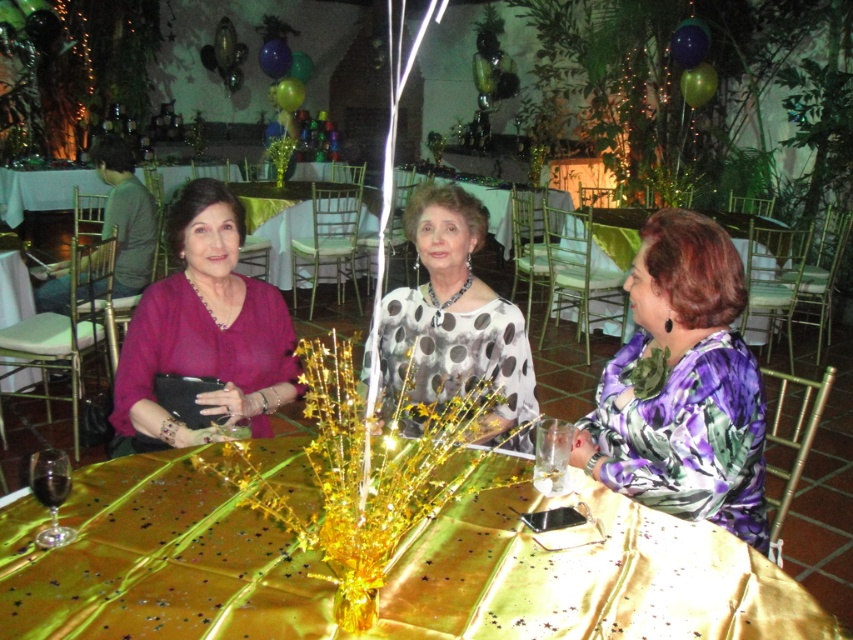
Looking at this image, is gold satin tablecloth at center below translucent glass wine glass at lower left?

Incorrect, gold satin tablecloth at center is not positioned below translucent glass wine glass at lower left.

Is gold satin tablecloth at center smaller than translucent glass wine glass at lower left?

No.

Does point (45, 209) come behind point (41, 502)?

That is True.

You are a GUI agent. You are given a task and a screenshot of the screen. Output one action in this format:
    pyautogui.click(x=<x>, y=<y>)
    Task: Click on the gold satin tablecloth at center
    This screenshot has width=853, height=640.
    Given the screenshot: What is the action you would take?
    pyautogui.click(x=44, y=189)

Does matte black table at center have a greater width compared to translucent glass wine glass at lower left?

Correct, the width of matte black table at center exceeds that of translucent glass wine glass at lower left.

Is matte black table at center further to the viewer compared to translucent glass wine glass at lower left?

Yes, matte black table at center is behind translucent glass wine glass at lower left.

Locate an element on the screen. matte black table at center is located at coordinates (485, 205).

Between point (271, 477) and point (538, 490), which one is positioned in front?

Point (538, 490) is in front.

Does metallic gold table at center have a smaller size compared to transparent glass at center?

No, metallic gold table at center is not smaller than transparent glass at center.

What do you see at coordinates (584, 573) in the screenshot? This screenshot has width=853, height=640. I see `metallic gold table at center` at bounding box center [584, 573].

Where is `metallic gold table at center`? The width and height of the screenshot is (853, 640). metallic gold table at center is located at coordinates pyautogui.click(x=584, y=573).